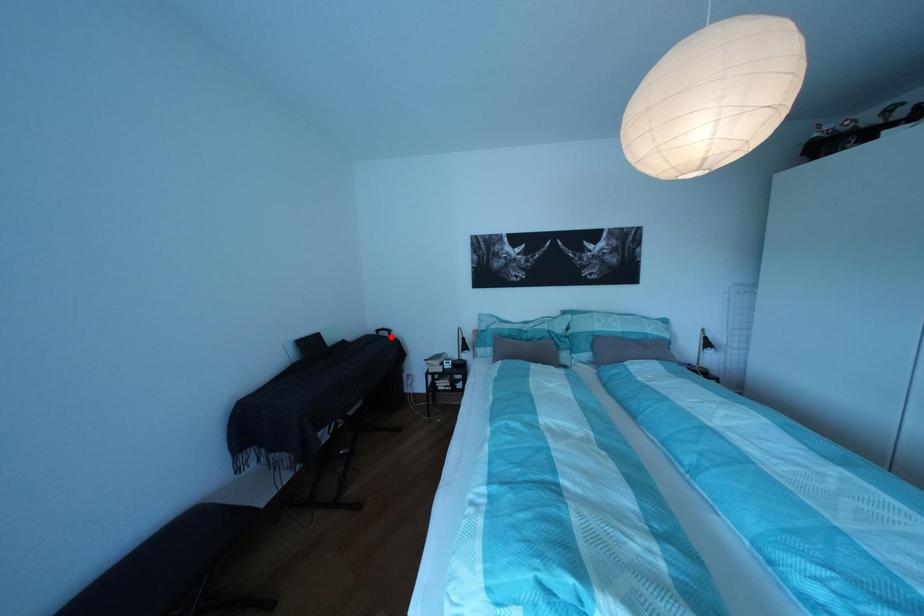
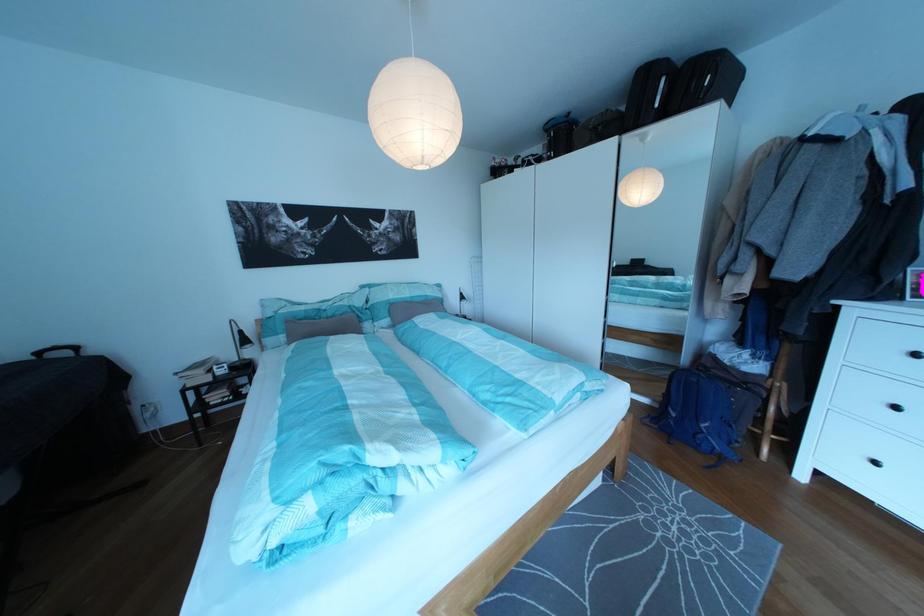
Question: I am providing you with two images of the same scene from different viewpoints. A red point is marked on the first image. At the location where the point appears in image 1, is it still visible in image 2?

Choices:
 (A) Yes
 (B) No

Answer: (A)